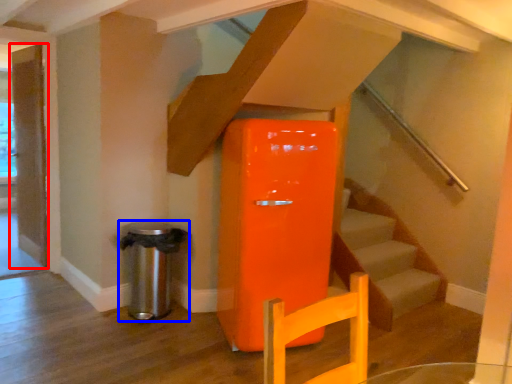
Question: Which object appears farthest to the camera in this image, door (highlighted by a red box) or water heater (highlighted by a blue box)?

Choices:
 (A) door
 (B) water heater

Answer: (A)